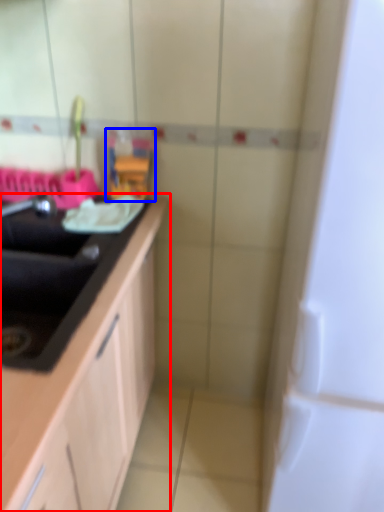
Question: Which point is closer to the camera, countertop (highlighted by a red box) or toy (highlighted by a blue box)?

Choices:
 (A) countertop
 (B) toy

Answer: (A)